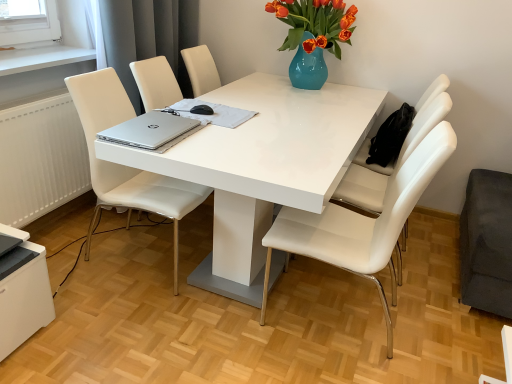
Locate an element on the screen. free region under white leather chair at right, which ranks as the second chair in left-to-right order (from a real-world perspective) is located at coordinates (347, 326).